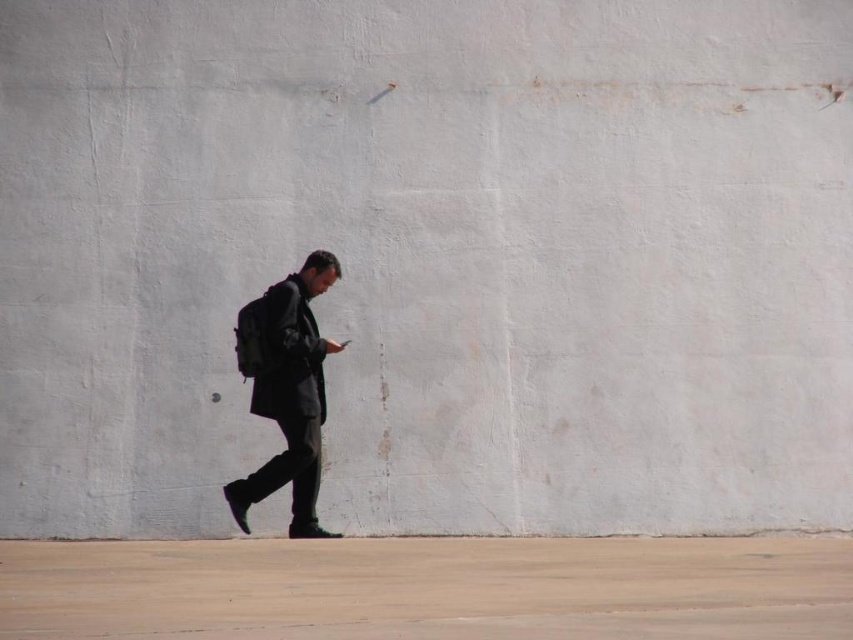
Does brown concrete pavement at lower center have a greater height compared to dark gray matte jacket at center?

Incorrect, brown concrete pavement at lower center's height is not larger of dark gray matte jacket at center's.

You are a GUI agent. You are given a task and a screenshot of the screen. Output one action in this format:
    pyautogui.click(x=<x>, y=<y>)
    Task: Click on the brown concrete pavement at lower center
    This screenshot has height=640, width=853.
    Given the screenshot: What is the action you would take?
    pyautogui.click(x=428, y=588)